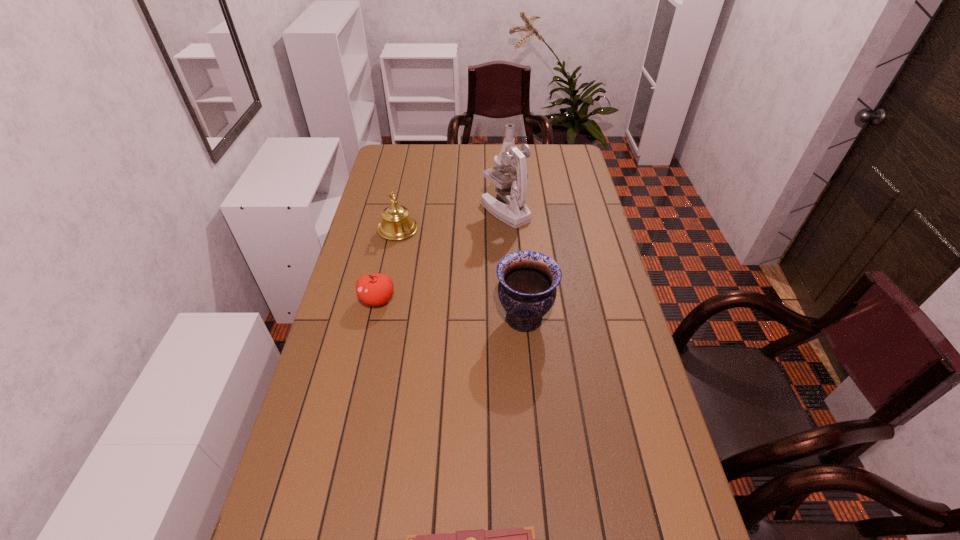
Where is `the tallest object`? The image size is (960, 540). the tallest object is located at coordinates (512, 189).

The image size is (960, 540). Find the location of `pottery`. pottery is located at coordinates (527, 284).

The height and width of the screenshot is (540, 960). I want to click on bell, so click(396, 224).

At what (x,y) coordinates should I click in order to perform the action: click on apple. Please return your answer as a coordinate pair (x, y). Looking at the image, I should click on (376, 289).

Locate an element on the screen. This screenshot has height=540, width=960. free space located on the left of the microscope is located at coordinates (448, 211).

Find the location of `free space located 0.290m on the front handle of the second tallest object`. free space located 0.290m on the front handle of the second tallest object is located at coordinates (400, 319).

Identify the location of free point located on the front handle of the second tallest object. (426, 319).

Where is `vacant area located 0.260m on the front handle of the second tallest object`? The image size is (960, 540). vacant area located 0.260m on the front handle of the second tallest object is located at coordinates (410, 319).

This screenshot has width=960, height=540. What are the coordinates of `free space located 0.210m on the right of the third tallest object` in the screenshot? It's located at click(473, 230).

Where is `blank space located 0.150m on the back of the fourth tallest object`? The height and width of the screenshot is (540, 960). blank space located 0.150m on the back of the fourth tallest object is located at coordinates (387, 257).